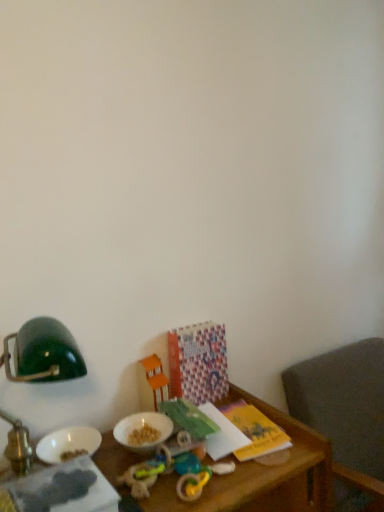
Question: From the image's perspective, is green matte lampshade at upper left located above gray fabric chair at lower right?

Choices:
 (A) no
 (B) yes

Answer: (B)

Question: From a real-world perspective, is green matte lampshade at upper left located higher than gray fabric chair at lower right?

Choices:
 (A) yes
 (B) no

Answer: (A)

Question: Is green matte lampshade at upper left thinner than gray fabric chair at lower right?

Choices:
 (A) yes
 (B) no

Answer: (A)

Question: Are green matte lampshade at upper left and gray fabric chair at lower right beside each other?

Choices:
 (A) yes
 (B) no

Answer: (B)

Question: Is green matte lampshade at upper left closer to camera compared to gray fabric chair at lower right?

Choices:
 (A) no
 (B) yes

Answer: (B)

Question: In terms of height, does matte green book at lower left, marked as the 1th book in a left-to-right arrangement, look taller or shorter compared to rubber teething ring at lower center, the first toy when ordered from front to back?

Choices:
 (A) tall
 (B) short

Answer: (A)

Question: From a real-world perspective, relative to rubber teething ring at lower center, the first toy when ordered from front to back, is matte green book at lower left, which is counted as the 2th book, starting from the right, vertically above or below?

Choices:
 (A) below
 (B) above

Answer: (B)

Question: Is matte green book at lower left, which is counted as the 2th book, starting from the right, to the left or to the right of rubber teething ring at lower center, the first toy when ordered from front to back, in the image?

Choices:
 (A) left
 (B) right

Answer: (A)

Question: In terms of width, does matte green book at lower left, the 1th book from the front, look wider or thinner when compared to rubber teething ring at lower center, which is counted as the 3th toy, starting from the back?

Choices:
 (A) wide
 (B) thin

Answer: (A)

Question: From the image's perspective, is rubber chew toy at lower center, the second toy viewed from the front, above or below green matte lampshade at upper left?

Choices:
 (A) above
 (B) below

Answer: (B)

Question: Is rubber chew toy at lower center, acting as the second toy starting from the back, in front of or behind green matte lampshade at upper left in the image?

Choices:
 (A) behind
 (B) front

Answer: (A)

Question: Does point (137, 492) appear closer or farther from the camera than point (72, 345)?

Choices:
 (A) closer
 (B) farther

Answer: (A)

Question: From their relative heights in the image, would you say rubber chew toy at lower center, acting as the second toy starting from the back, is taller or shorter than green matte lampshade at upper left?

Choices:
 (A) tall
 (B) short

Answer: (B)

Question: Considering their positions, is green matte lampshade at upper left located in front of or behind rubber chew toy at lower center, acting as the second toy starting from the back?

Choices:
 (A) behind
 (B) front

Answer: (B)

Question: From their relative heights in the image, would you say green matte lampshade at upper left is taller or shorter than rubber chew toy at lower center, the second toy viewed from the front?

Choices:
 (A) short
 (B) tall

Answer: (B)